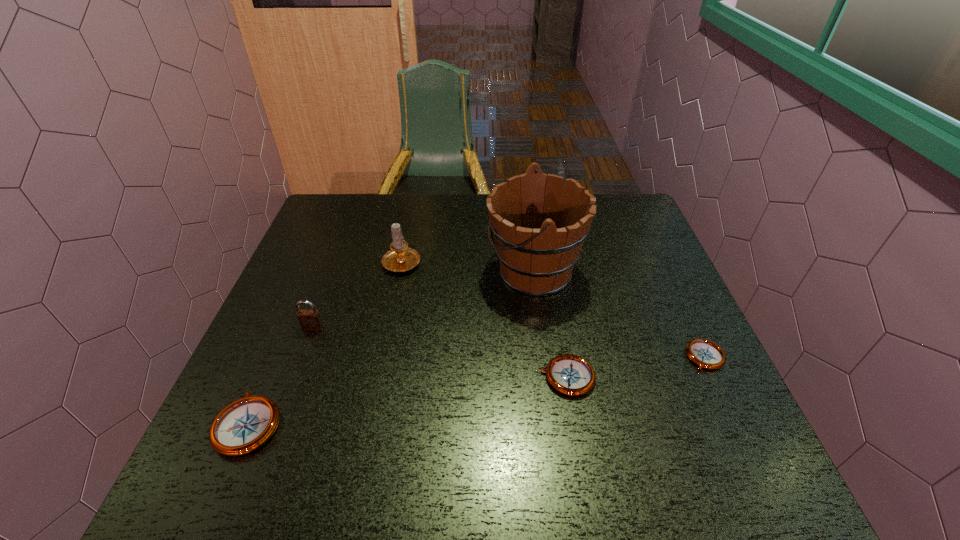
At what (x,y) coordinates should I click in order to perform the action: click on padlock. Please return your answer as a coordinate pair (x, y). This screenshot has height=540, width=960. Looking at the image, I should click on (310, 320).

The image size is (960, 540). What are the coordinates of `vacant space situated on the right of the fourth tallest object` in the screenshot? It's located at coord(348,423).

Locate an element on the screen. This screenshot has height=540, width=960. free space located on the right of the second tallest compass is located at coordinates (650, 377).

The width and height of the screenshot is (960, 540). I want to click on vacant space situated 0.050m on the back of the rightmost object, so click(x=690, y=325).

Find the location of a particular element. The image size is (960, 540). vacant space located on the right of the candle is located at coordinates (564, 261).

Where is `vacant space located 0.120m with the handle on the wine bucket`? Image resolution: width=960 pixels, height=540 pixels. vacant space located 0.120m with the handle on the wine bucket is located at coordinates (442, 271).

The height and width of the screenshot is (540, 960). Find the location of `vacant region located with the handle on the wine bucket`. vacant region located with the handle on the wine bucket is located at coordinates (413, 271).

The image size is (960, 540). In order to click on vacant area situated with the handle on the wine bucket in this screenshot , I will do `click(464, 271)`.

Image resolution: width=960 pixels, height=540 pixels. In order to click on vacant area situated on the front-facing side of the padlock in this screenshot , I will do `click(291, 389)`.

I want to click on compass at the left edge, so click(243, 426).